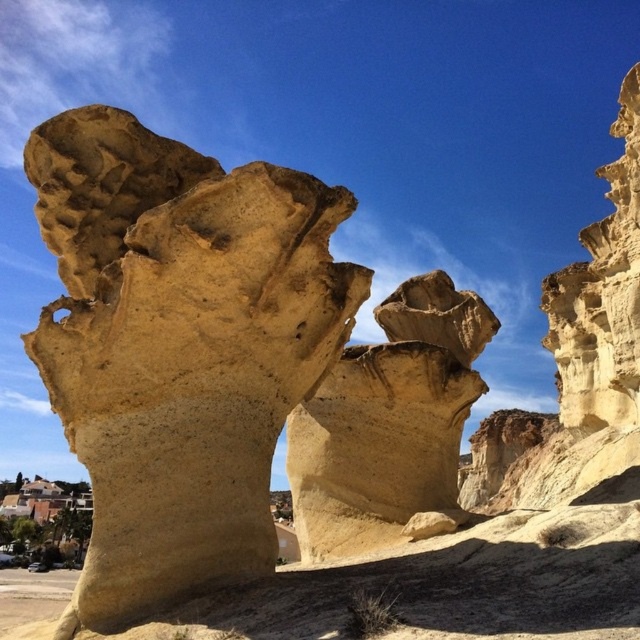
You are a geologist examining the sandstone rock formation at center and the smooth beige rock at center. Which rock formation is located to the left of the other?

The sandstone rock formation at center is positioned on the left side of smooth beige rock at center.

You are a geologist examining the sandstone rock formation at center and the smooth beige rock at center. Based on their positions, which one would you expect to be older?

The sandstone rock formation at center is in front of the smooth beige rock at center, so the smooth beige rock at center is likely older because it is positioned behind and thus formed earlier.

You are standing at the center of the image. Looking towards the sandstone rock formation at center, which direction should you face to see it?

Since the sandstone rock formation at center is located at point coordinates of (179, 346), which is slightly to the right and above the exact center of the image, you should face slightly to the right and upwards to see it.